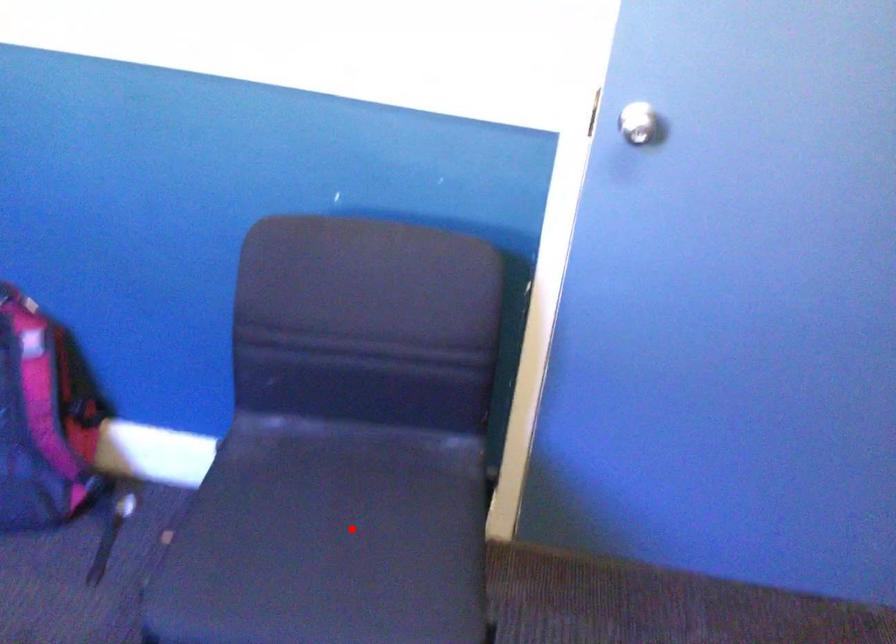
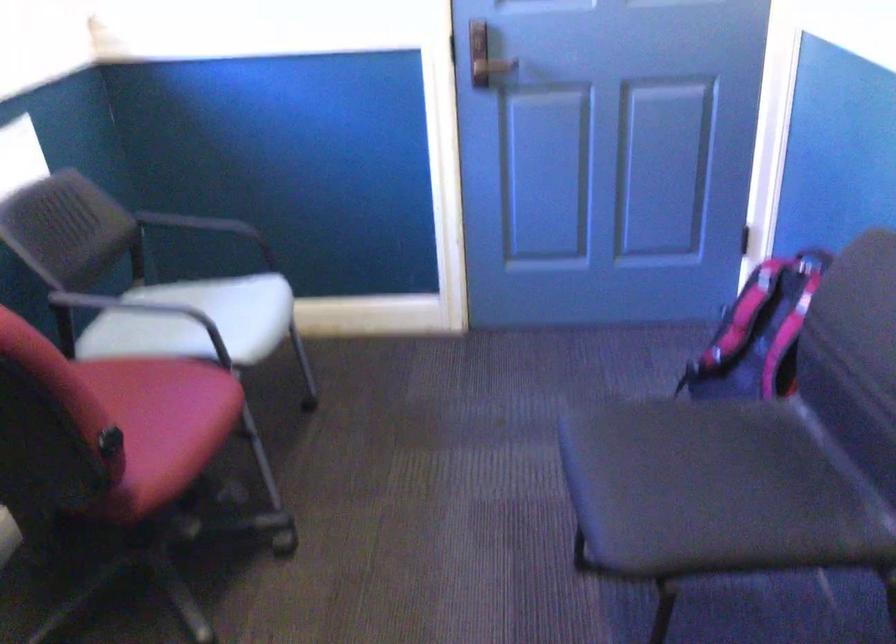
Where in the second image is the point corresponding to the highlighted location from the first image?

(698, 485)